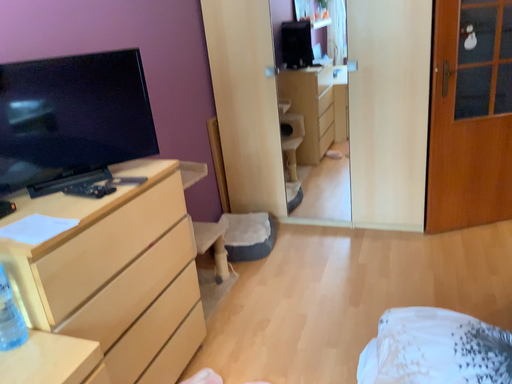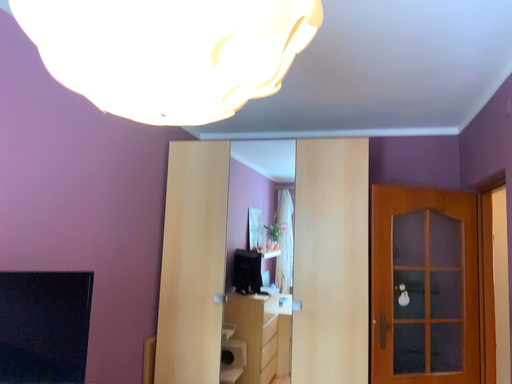
Question: How did the camera likely rotate when shooting the video?

Choices:
 (A) rotated upward
 (B) rotated downward

Answer: (A)